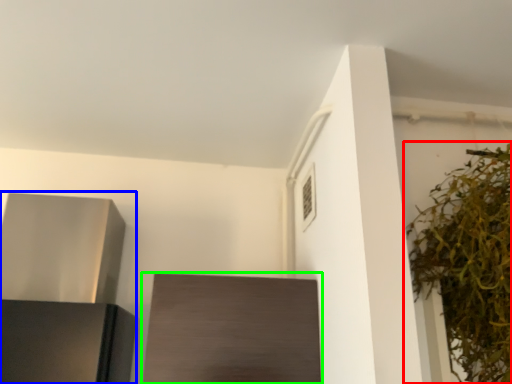
Question: Which is farther away from houseplant (highlighted by a red box)? appliance (highlighted by a blue box) or cabinetry (highlighted by a green box)?

Choices:
 (A) appliance
 (B) cabinetry

Answer: (A)